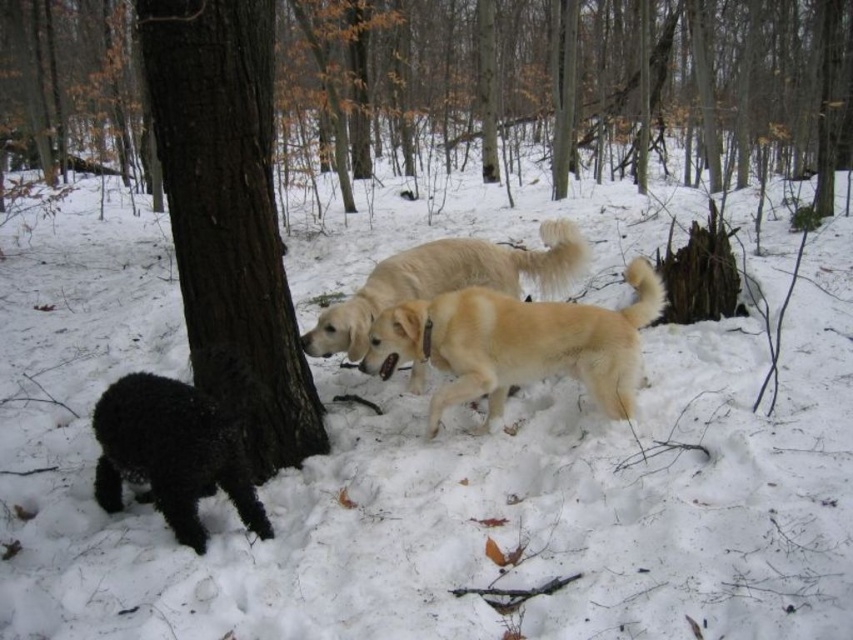
Can you confirm if dark brown bark at center is positioned above light golden fur at center?

Indeed, dark brown bark at center is positioned over light golden fur at center.

From the picture: Is dark brown bark at center to the left of light golden fur at center from the viewer's perspective?

Correct, you'll find dark brown bark at center to the left of light golden fur at center.

Which is in front, point (250, 426) or point (368, 289)?

Point (250, 426)

At what (x,y) coordinates should I click in order to perform the action: click on dark brown bark at center. Please return your answer as a coordinate pair (x, y). Looking at the image, I should click on (229, 214).

Who is taller, dark brown bark at center or golden fur dog at center?

dark brown bark at center is taller.

Which is more to the left, dark brown bark at center or golden fur dog at center?

dark brown bark at center

Measure the distance between dark brown bark at center and camera.

9.12 feet

Locate an element on the screen. The image size is (853, 640). dark brown bark at center is located at coordinates (229, 214).

Can you confirm if brown rough tree trunk at center is positioned above dark brown bark at center?

Correct, brown rough tree trunk at center is located above dark brown bark at center.

Does point (849, 102) lie in front of point (148, 8)?

No, it is behind (148, 8).

Is point (405, 93) positioned in front of point (254, 435)?

No, (405, 93) is further to viewer.

In order to click on brown rough tree trunk at center in this screenshot , I will do `click(575, 80)`.